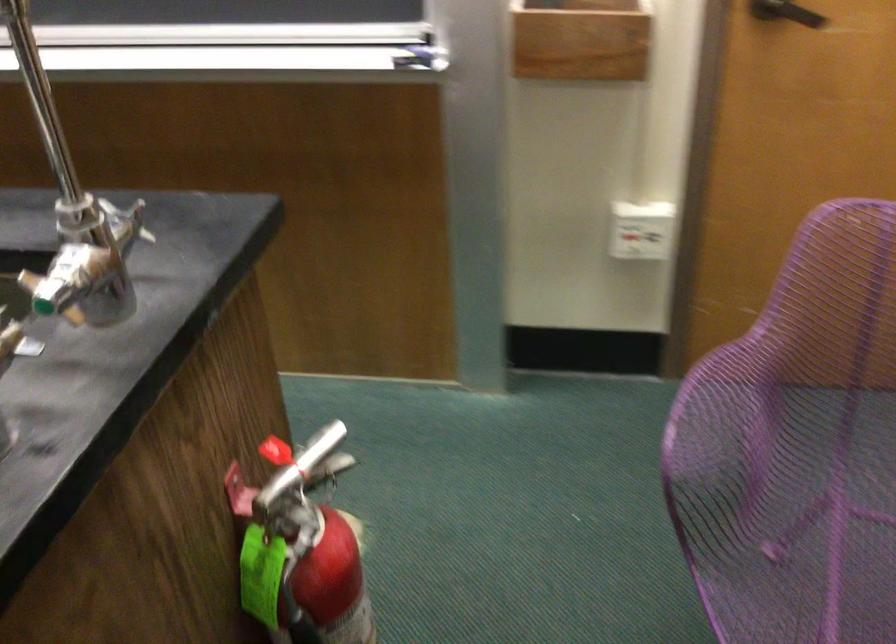
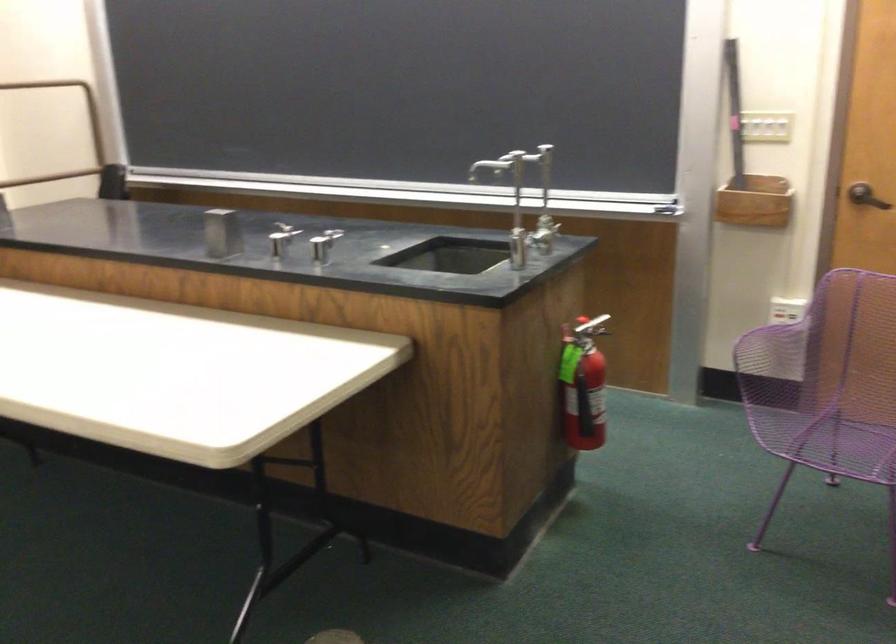
Find the pixel in the second image that matches (x=668, y=258) in the first image.

(787, 310)